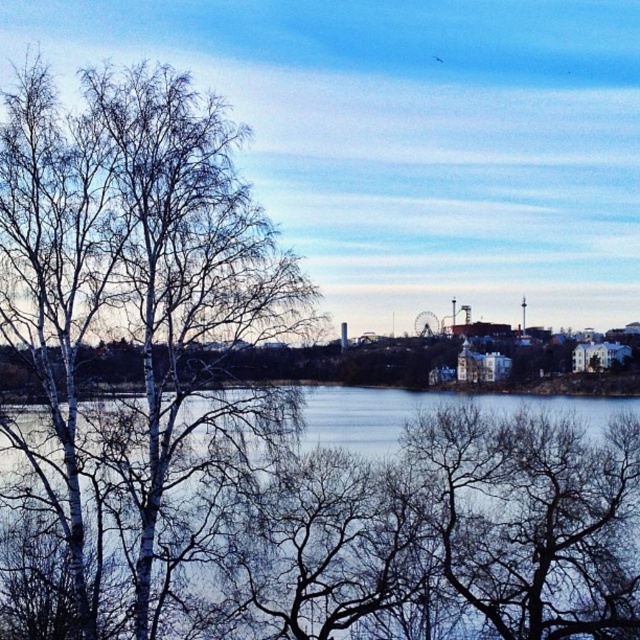
You are an artist planning to paint the lakeside scene. You want to ensure the proportions between the bare white tree at left and the blue water at center are accurate. Which object should you depict as taller in your painting?

The bare white tree at left should be depicted as taller than the blue water at center in your painting, as it is much taller according to the description.

You are standing at the lakeside and want to take a photo of the blue water at center without the bare white tree at left blocking the view. Which direction should you move to ensure the tree is no longer in your shot?

You should move to the right side of the scene so that the bare white tree at left is no longer blocking the blue water at center, as the tree is positioned to the left of the water.

You are standing at the lakeside and see a point marked at coordinates [134,353]. Based on the scene description, can you identify what object this point is located on?

The point at coordinates [134,353] is located on the bare white tree at left.